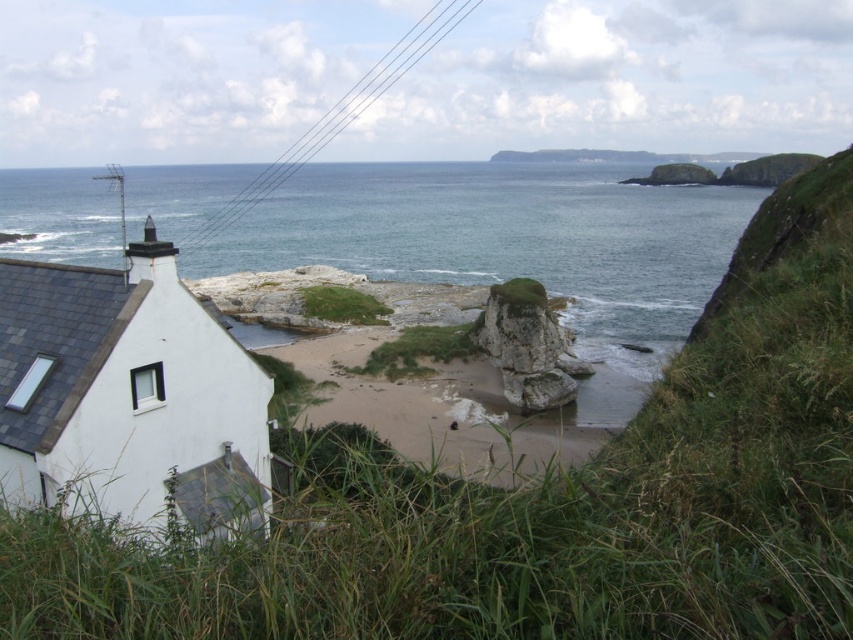
Is blue water at center above white matte house at lower left?

Yes.

Does blue water at center have a lesser width compared to white matte house at lower left?

No, blue water at center is not thinner than white matte house at lower left.

Describe the element at coordinates (476, 236) in the screenshot. I see `blue water at center` at that location.

I want to click on blue water at center, so 476,236.

Is white matte house at lower left closer to the viewer compared to rough stone rock at center?

Yes, it is.

You are a GUI agent. You are given a task and a screenshot of the screen. Output one action in this format:
    pyautogui.click(x=<x>, y=<y>)
    Task: Click on the white matte house at lower left
    The height and width of the screenshot is (640, 853).
    Given the screenshot: What is the action you would take?
    pyautogui.click(x=129, y=397)

Find the location of a particular element. The image size is (853, 640). blue water at center is located at coordinates click(476, 236).

Between point (496, 195) and point (489, 349), which one is positioned behind?

The point (496, 195) is more distant.

Who is more distant from viewer, (636, 205) or (572, 394)?

The point (636, 205) is behind.

Where is `blue water at center`? This screenshot has height=640, width=853. blue water at center is located at coordinates (476, 236).